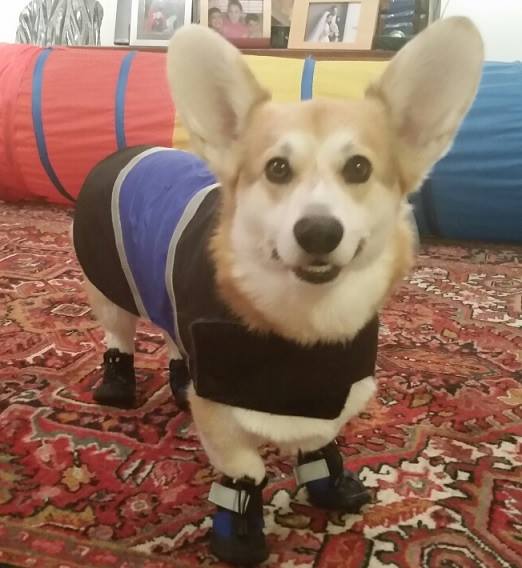
Image resolution: width=522 pixels, height=568 pixels. I want to click on blanket, so click(147, 179).